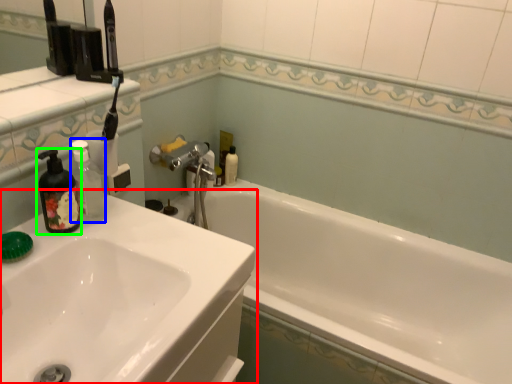
Question: Which object is positioned closest to sink (highlighted by a red box)? Select from bottle (highlighted by a blue box) and soap dispenser (highlighted by a green box).

Choices:
 (A) bottle
 (B) soap dispenser

Answer: (B)